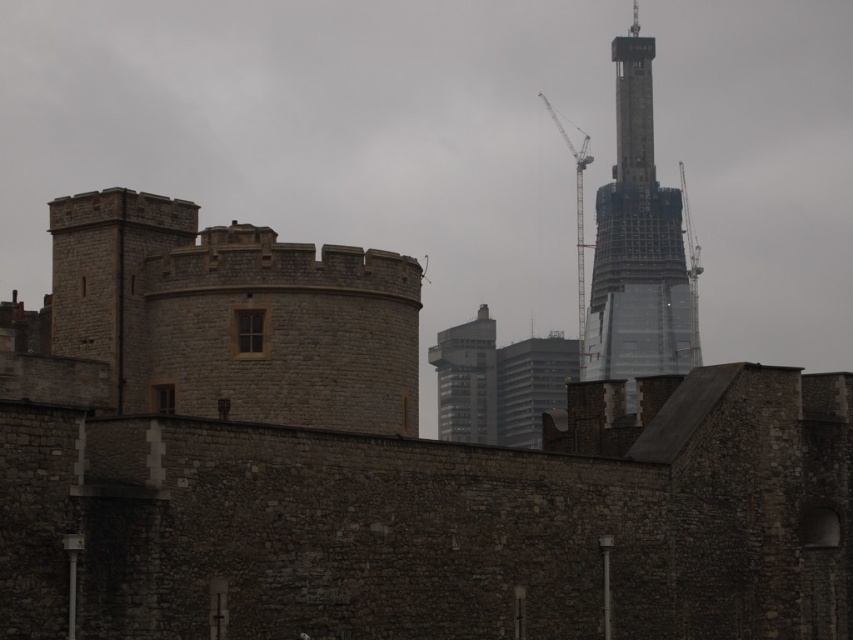
You are an architect observing the image. You need to determine which object occupies more space in the scene between the transparent glass tower at upper right and the metallic gray crane at upper right. Based on the scene, which one is bigger?

The transparent glass tower at upper right has a larger size compared to the metallic gray crane at upper right, so the transparent glass tower at upper right occupies more space in the scene.

You are an architect evaluating the construction site. You need to determine if the transparent glass tower at upper right can be safely positioned next to the metallic gray crane at upper right. Based on their widths, is there enough space between them?

The transparent glass tower at upper right is wider than the metallic gray crane at upper right. Since the tower is wider, there might not be sufficient space between them for safe positioning unless additional adjustments are made to accommodate the tower.

You are an architect examining the image of the historical stone wall and modern skyscraper. You notice two points marked in the image. Which of the two points, point (485,365) or point (577,202), is closer to your viewpoint?

Point (485,365) is closer to the viewer than point (577,202).